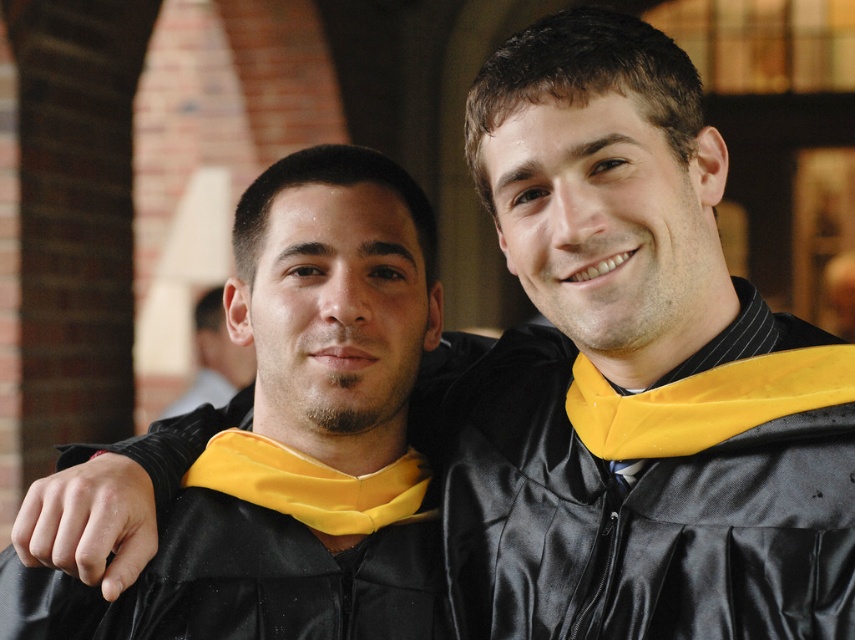
Question: Among these objects, which one is farthest from the camera?

Choices:
 (A) matte black ear at center
 (B) matte black graduation gown at center

Answer: (A)

Question: Does matte black graduation gown at center have a lesser width compared to matte black ear at center?

Choices:
 (A) no
 (B) yes

Answer: (A)

Question: Is matte black graduation gown at center wider than matte black ear at center?

Choices:
 (A) yes
 (B) no

Answer: (A)

Question: Can you confirm if matte black graduation gown at center is positioned to the left of matte black ear at center?

Choices:
 (A) no
 (B) yes

Answer: (A)

Question: Which point is farther to the camera?

Choices:
 (A) matte black ear at center
 (B) matte black graduation gown at center

Answer: (A)